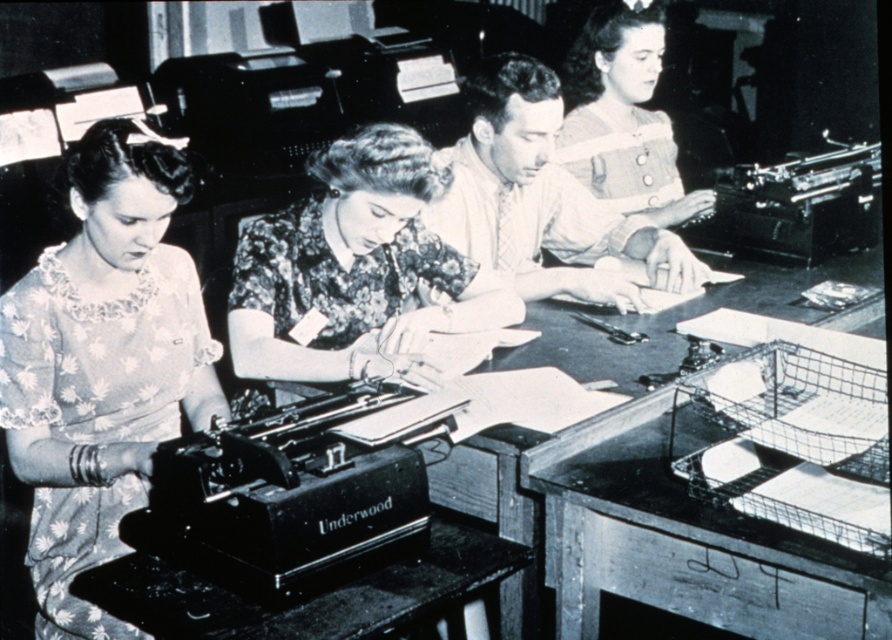
Which is more to the right, floral lace blouse at left or metallic black typewriter at lower left?

Positioned to the right is metallic black typewriter at lower left.

Does floral lace blouse at left lie in front of metallic black typewriter at lower left?

No, it is behind metallic black typewriter at lower left.

I want to click on floral lace blouse at left, so click(x=102, y=364).

Is floral lace blouse at left taller than matte brown blouse at center?

Yes, floral lace blouse at left is taller than matte brown blouse at center.

Which is more to the left, floral lace blouse at left or matte brown blouse at center?

From the viewer's perspective, floral lace blouse at left appears more on the left side.

What do you see at coordinates (102, 364) in the screenshot?
I see `floral lace blouse at left` at bounding box center [102, 364].

Find the location of a particular element. floral lace blouse at left is located at coordinates (102, 364).

Can you confirm if floral lace blouse at left is shorter than floral fabric blouse at center?

No.

Is point (194, 378) positioned behind point (336, 188)?

That is False.

This screenshot has height=640, width=892. Identify the location of floral lace blouse at left. (102, 364).